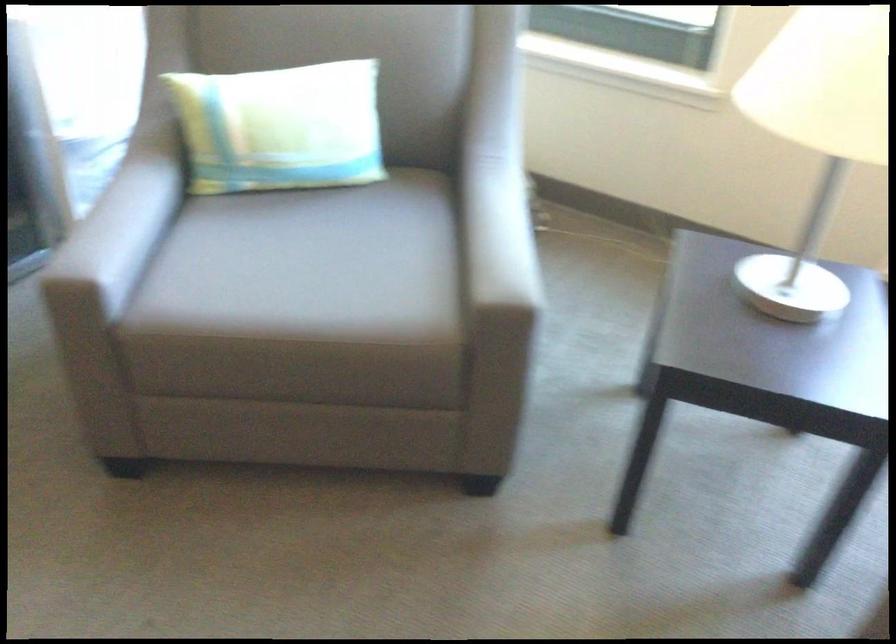
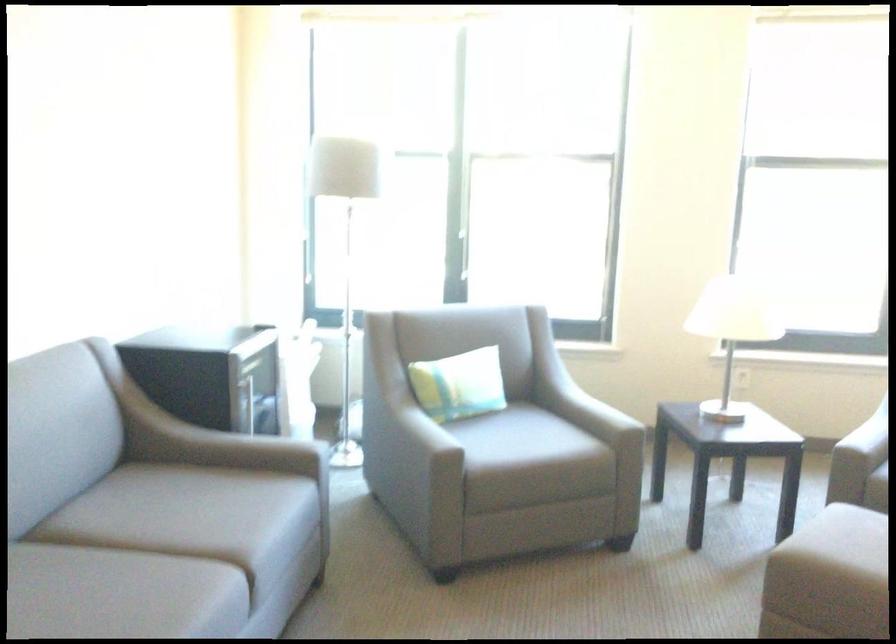
In the second image, find the point that corresponds to (339,144) in the first image.

(459, 384)